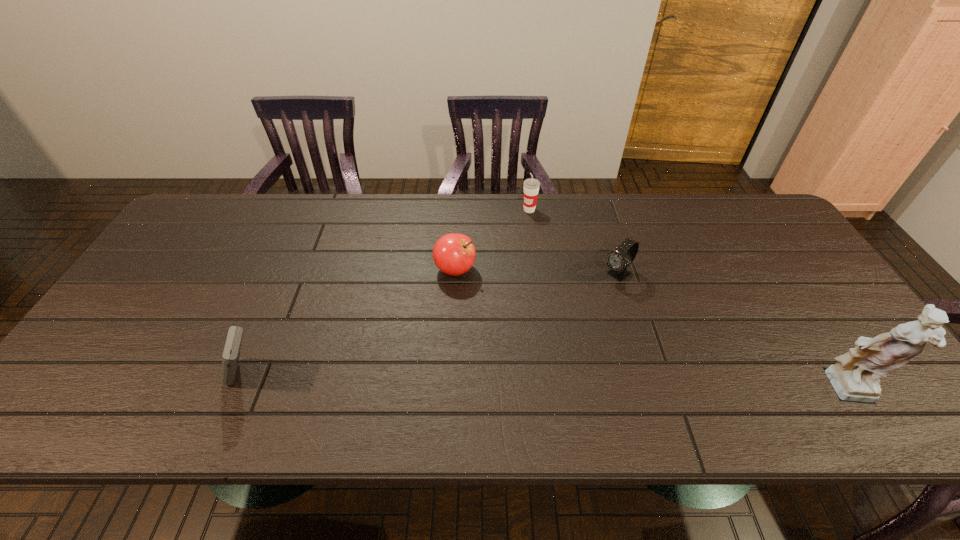
The image size is (960, 540). I want to click on blank space located on the stem of the fourth object from right to left, so click(x=515, y=327).

Find the location of `vacant space located 0.330m on the stem of the fourth object from right to left`. vacant space located 0.330m on the stem of the fourth object from right to left is located at coordinates (551, 362).

Image resolution: width=960 pixels, height=540 pixels. I want to click on free spot located 0.130m on the stem of the fourth object from right to left, so click(497, 310).

What are the coordinates of `vacant space located 0.160m on the face of the watch` in the screenshot? It's located at (569, 313).

In order to click on free location located on the face of the watch in this screenshot , I will do `click(594, 294)`.

At what (x,y) coordinates should I click in order to perform the action: click on free location located 0.160m on the face of the watch. Please return your answer as a coordinate pair (x, y). This screenshot has width=960, height=540. Looking at the image, I should click on (569, 313).

Locate an element on the screen. blank area located 0.400m on the side of the third object from left to right with the logo is located at coordinates click(492, 305).

The height and width of the screenshot is (540, 960). Identify the location of vacant region located on the side of the third object from left to right with the logo. (520, 232).

Locate an element on the screen. This screenshot has width=960, height=540. vacant area situated on the side of the third object from left to right with the logo is located at coordinates (506, 268).

Locate an element on the screen. Image resolution: width=960 pixels, height=540 pixels. object at the far edge is located at coordinates (531, 186).